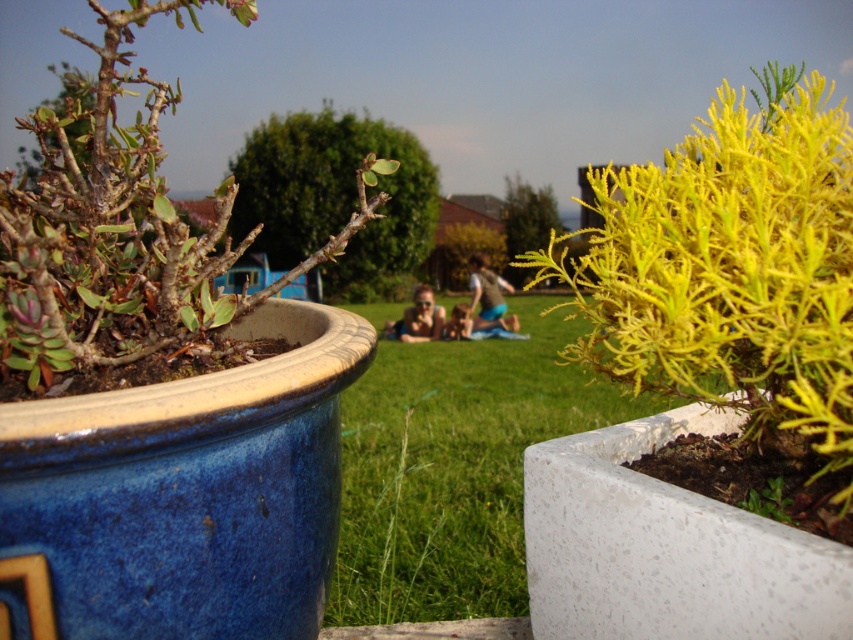
You are standing in the garden looking at the two potted plants. There are two points marked in the scene. The first point is at coordinates point (650, 192) and the second is at point (395, 321). If you were to walk towards the point that is closer to you, which point would you be approaching?

Point (650, 192) is in front of point (395, 321), so approaching point (650, 192) would mean moving toward the closer one.